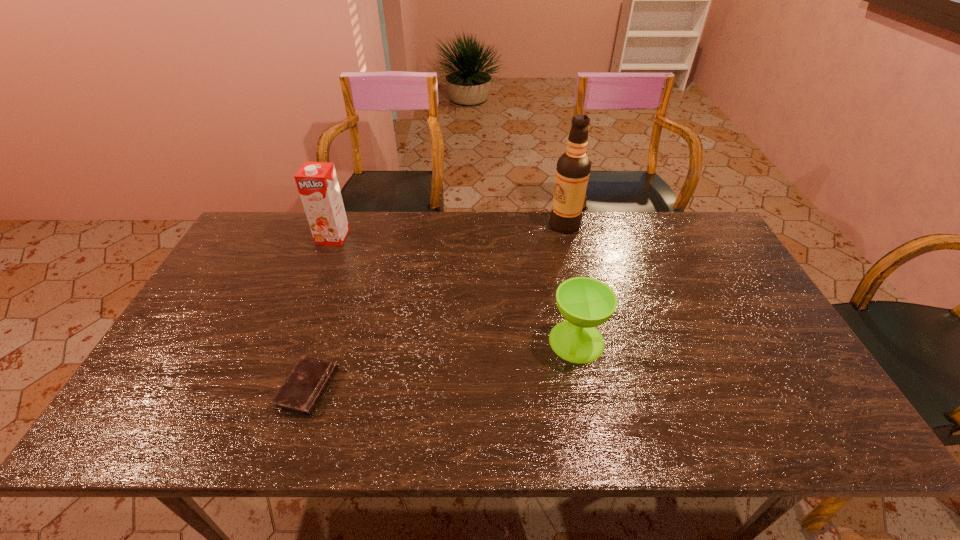
The height and width of the screenshot is (540, 960). Find the location of `vacant position in the image that satisfies the following two spatial constraints: 1. on the label of the tallest object; 2. on the front side of the wineglass`. vacant position in the image that satisfies the following two spatial constraints: 1. on the label of the tallest object; 2. on the front side of the wineglass is located at coordinates (591, 341).

Find the location of a particular element. The width and height of the screenshot is (960, 540). vacant space that satisfies the following two spatial constraints: 1. on the back side of the wineglass; 2. on the left side of the shortest object is located at coordinates (324, 341).